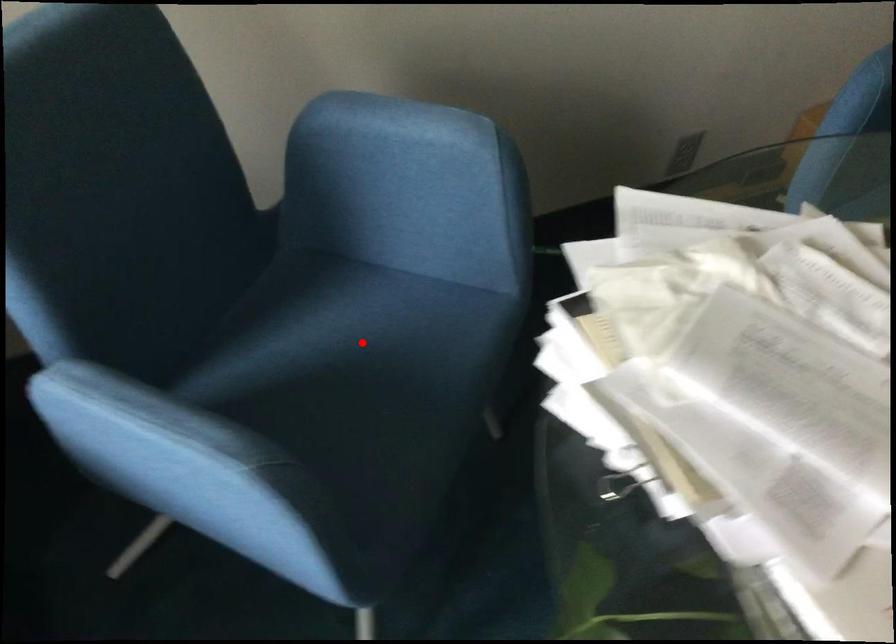
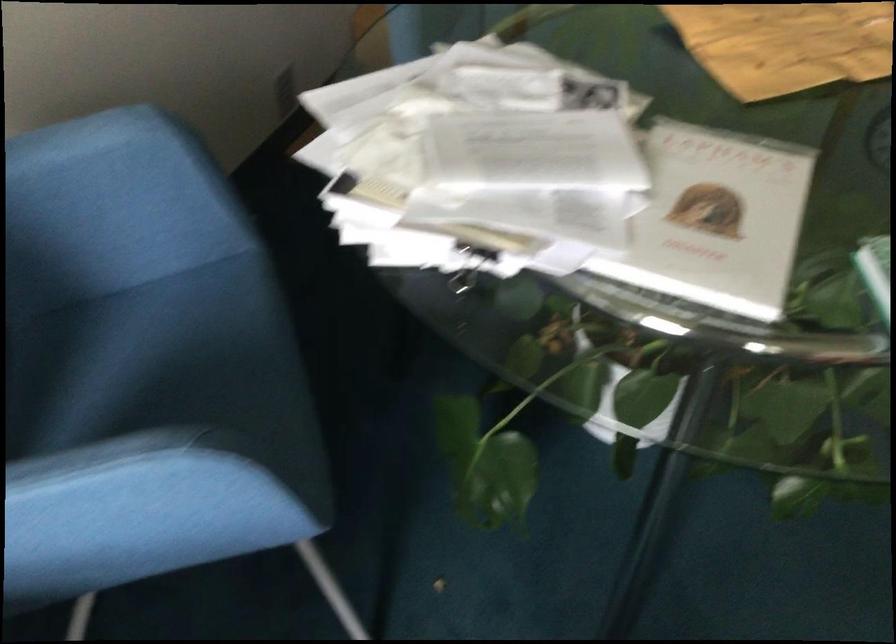
Find the pixel in the second image that matches the highlighted location in the first image.

(158, 357)